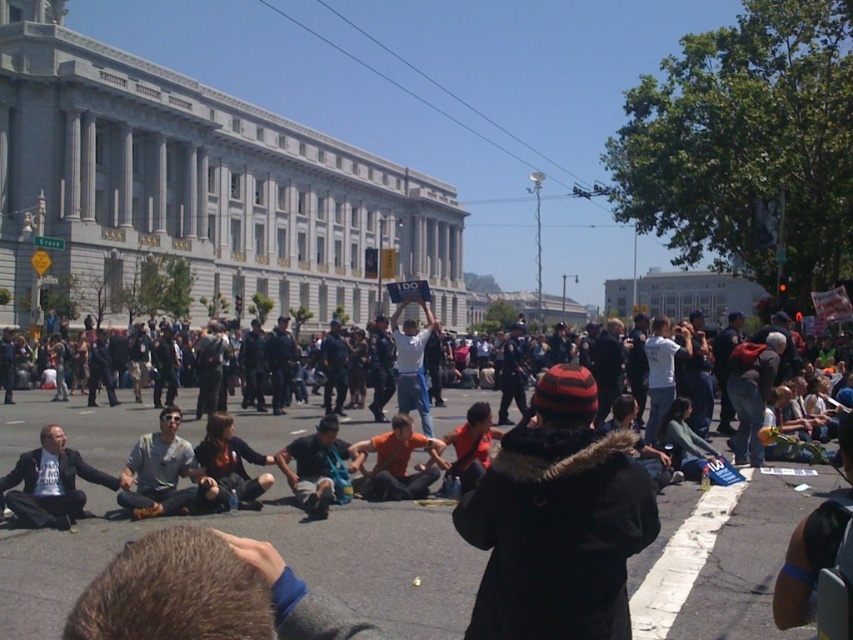
Is brown hair at lower center bigger than gray cotton shirt at center?

No, brown hair at lower center is not bigger than gray cotton shirt at center.

Measure the distance between point (x=119, y=624) and camera.

They are 12.36 meters apart.

Between point (138, 576) and point (204, 483), which one is positioned behind?

Positioned behind is point (204, 483).

This screenshot has width=853, height=640. Find the location of `brown hair at lower center`. brown hair at lower center is located at coordinates (206, 593).

How far apart are brown hair at lower center and orange cotton shirt at center?

brown hair at lower center is 16.04 meters away from orange cotton shirt at center.

Is the position of brown hair at lower center more distant than that of orange cotton shirt at center?

No, brown hair at lower center is in front of orange cotton shirt at center.

What do you see at coordinates (206, 593) in the screenshot? The height and width of the screenshot is (640, 853). I see `brown hair at lower center` at bounding box center [206, 593].

Identify the location of brown hair at lower center. (206, 593).

Is dark blue jeans at center bigger than orange fabric shirt at center?

No, dark blue jeans at center is not bigger than orange fabric shirt at center.

Is dark blue jeans at center wider than orange fabric shirt at center?

Incorrect, dark blue jeans at center's width does not surpass orange fabric shirt at center's.

Does point (235, 449) come closer to viewer compared to point (483, 419)?

That is True.

Image resolution: width=853 pixels, height=640 pixels. I want to click on dark blue jeans at center, so click(x=228, y=467).